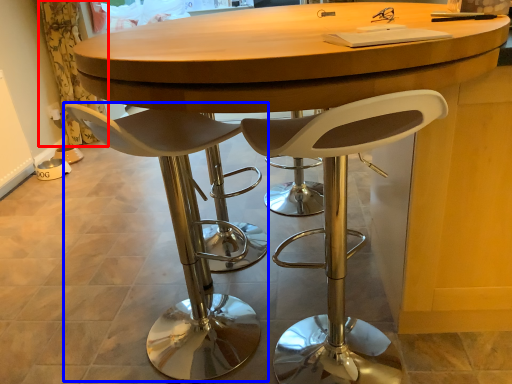
Question: Which object appears closest to the camera in this image, curtain (highlighted by a red box) or chair (highlighted by a blue box)?

Choices:
 (A) curtain
 (B) chair

Answer: (B)